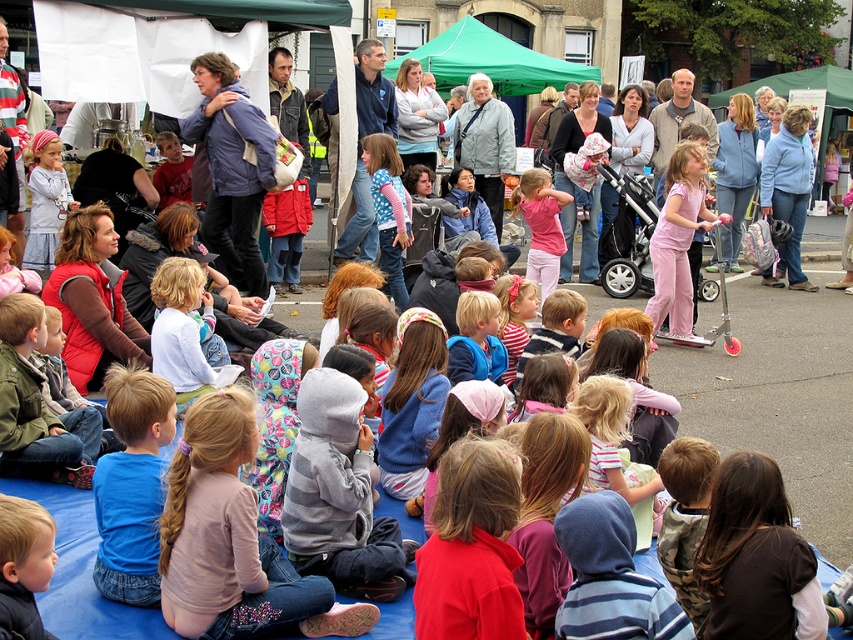
Question: Can you confirm if green fabric canopy at upper center is bigger than pink cotton pants at center?

Choices:
 (A) yes
 (B) no

Answer: (A)

Question: Which point is farther from the camera taking this photo?

Choices:
 (A) (190, 304)
 (B) (486, 58)

Answer: (B)

Question: Is green fabric canopy at upper center closer to camera compared to pink cotton pants at center?

Choices:
 (A) no
 (B) yes

Answer: (A)

Question: Estimate the real-world distances between objects in this image. Which object is farther from the light blue fabric at center?

Choices:
 (A) pink cotton pants at center
 (B) green fabric canopy at upper center

Answer: (B)

Question: Is pink cotton pants at center smaller than light blue fabric at center?

Choices:
 (A) yes
 (B) no

Answer: (B)

Question: Which object is the closest to the pink cotton pants at center?

Choices:
 (A) light blue fabric at center
 (B) green fabric canopy at upper center

Answer: (A)